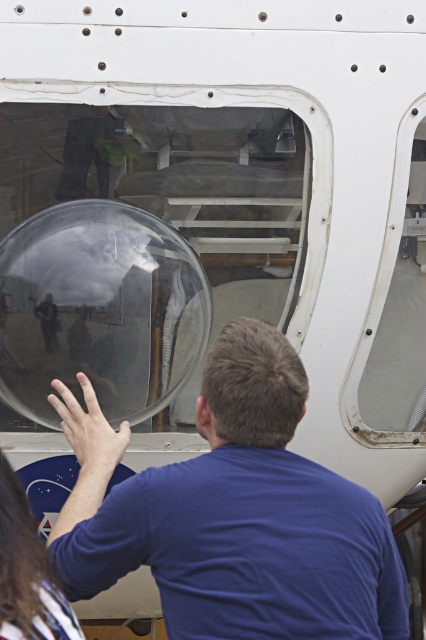
Question: Estimate the real-world distances between objects in this image. Which object is farther from the long brown hair at lower left?

Choices:
 (A) transparent glass bubble at center
 (B) blue matte shirt at center

Answer: (A)

Question: Can you confirm if blue matte shirt at center is positioned above long brown hair at lower left?

Choices:
 (A) no
 (B) yes

Answer: (B)

Question: Is blue matte shirt at center thinner than long brown hair at lower left?

Choices:
 (A) no
 (B) yes

Answer: (A)

Question: Which object appears farthest from the camera in this image?

Choices:
 (A) transparent glass bubble at center
 (B) blue matte shirt at center
 (C) long brown hair at lower left

Answer: (A)

Question: Which point appears farthest from the camera in this image?

Choices:
 (A) (20, 557)
 (B) (180, 264)

Answer: (B)

Question: Can you confirm if blue matte shirt at center is smaller than transparent glass bubble at center?

Choices:
 (A) no
 (B) yes

Answer: (A)